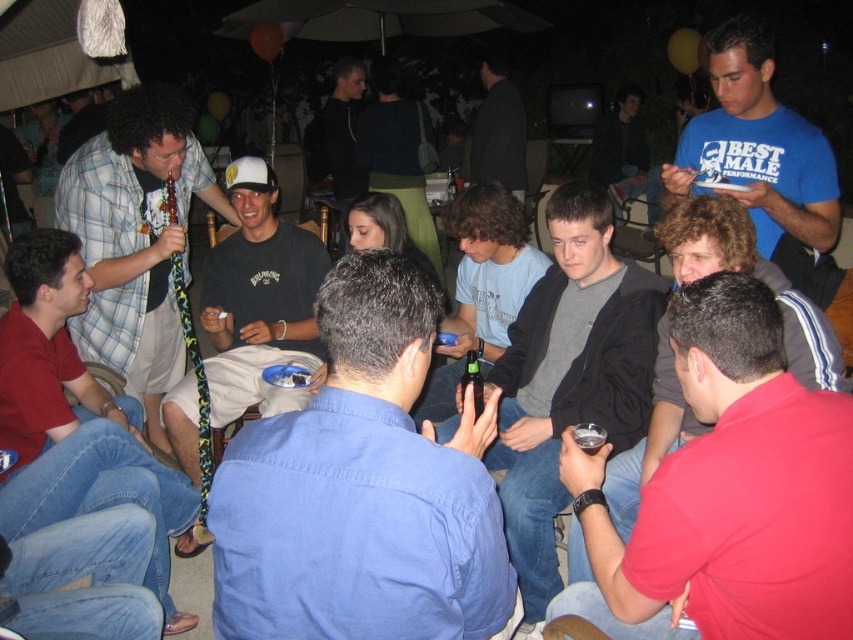
Question: Is gray cotton shirt at center behind plaid shirt at center?

Choices:
 (A) no
 (B) yes

Answer: (A)

Question: Among these objects, which one is farthest from the camera?

Choices:
 (A) red cotton polo shirt at lower right
 (B) blue cotton shirt at center

Answer: (A)

Question: Considering the relative positions of red cotton polo shirt at lower right and plaid shirt at center in the image provided, where is red cotton polo shirt at lower right located with respect to plaid shirt at center?

Choices:
 (A) right
 (B) left

Answer: (A)

Question: Which object is closer to the camera taking this photo?

Choices:
 (A) translucent glass at center
 (B) red cotton polo shirt at lower right

Answer: (B)

Question: Which of the following is the closest to the observer?

Choices:
 (A) (57, 205)
 (B) (531, 458)
 (C) (486, 147)

Answer: (B)

Question: Is the position of blue cotton shirt at center less distant than that of red cotton polo shirt at lower right?

Choices:
 (A) yes
 (B) no

Answer: (A)